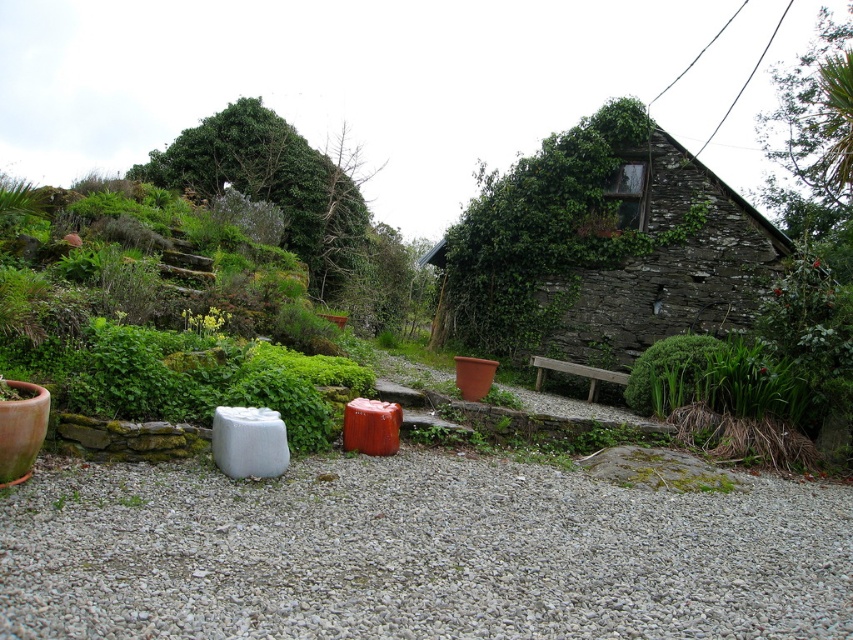
Can you confirm if gray gravel at center is positioned below stone textured cottage at center?

Yes, gray gravel at center is below stone textured cottage at center.

Locate an element on the screen. The height and width of the screenshot is (640, 853). gray gravel at center is located at coordinates (416, 552).